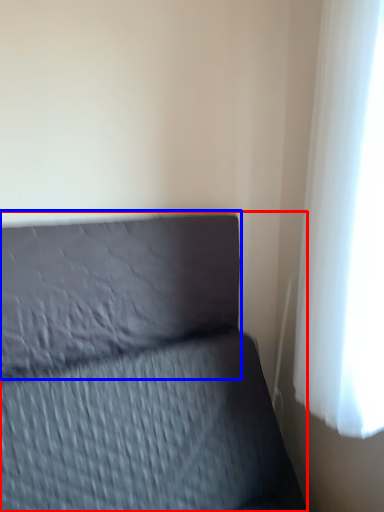
Question: Which object is further to the camera taking this photo, furniture (highlighted by a red box) or pillow (highlighted by a blue box)?

Choices:
 (A) furniture
 (B) pillow

Answer: (B)